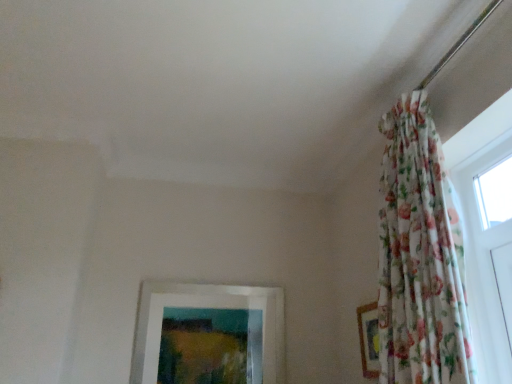
Question: Is floral fabric picture frame at right, positioned as the 1th picture frame in right-to-left order, in front of or behind white matte picture frame at lower center, acting as the 2th picture frame starting from the right, in the image?

Choices:
 (A) behind
 (B) front

Answer: (B)

Question: Is floral fabric picture frame at right, the second picture frame positioned from the back, inside the boundaries of white matte picture frame at lower center, acting as the 2th picture frame starting from the right, or outside?

Choices:
 (A) inside
 (B) outside

Answer: (B)

Question: Which object is positioned farthest from the white matte picture frame at lower center, acting as the 2th picture frame starting from the right?

Choices:
 (A) transparent glass window at upper right
 (B) floral fabric picture frame at right, which ranks as the 2th picture frame in left-to-right order
 (C) floral fabric curtain at upper right

Answer: (A)

Question: Considering the real-world distances, which object is farthest from the floral fabric picture frame at right, which ranks as the 2th picture frame in left-to-right order?

Choices:
 (A) white matte picture frame at lower center, the 1th picture frame when ordered from back to front
 (B) floral fabric curtain at upper right
 (C) transparent glass window at upper right

Answer: (C)